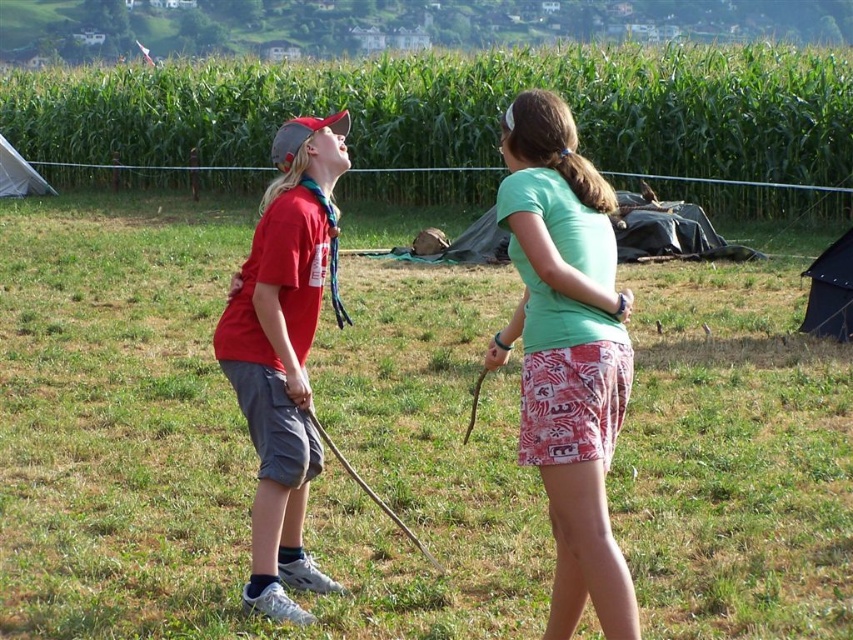
Question: Is green fabric shorts at center below green leafy corn at upper center?

Choices:
 (A) yes
 (B) no

Answer: (A)

Question: Does green fabric shorts at center appear on the left side of matte red shirt at left?

Choices:
 (A) yes
 (B) no

Answer: (B)

Question: Does green fabric shirt at center have a larger size compared to matte red shirt at left?

Choices:
 (A) yes
 (B) no

Answer: (A)

Question: Which is nearer to the green fabric shorts at center?

Choices:
 (A) matte red shirt at left
 (B) green leafy corn at upper center
 (C) green fabric shirt at center

Answer: (C)

Question: Which of the following is the closest to the observer?

Choices:
 (A) (323, 118)
 (B) (668, 282)
 (C) (599, 237)

Answer: (C)

Question: Which of the following is the closest to the observer?

Choices:
 (A) (230, 285)
 (B) (779, 154)

Answer: (A)